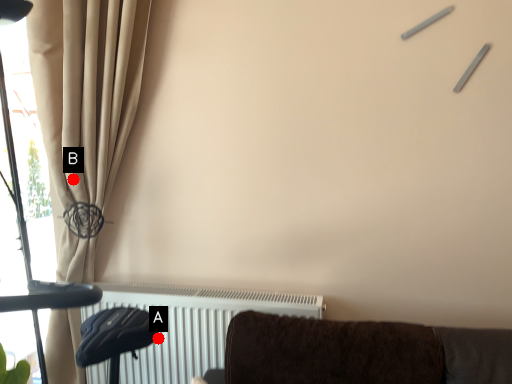
Question: Two points are circled on the image, labeled by A and B beside each circle. Which of the following is the closest to the observer?

Choices:
 (A) A is closer
 (B) B is closer

Answer: (B)